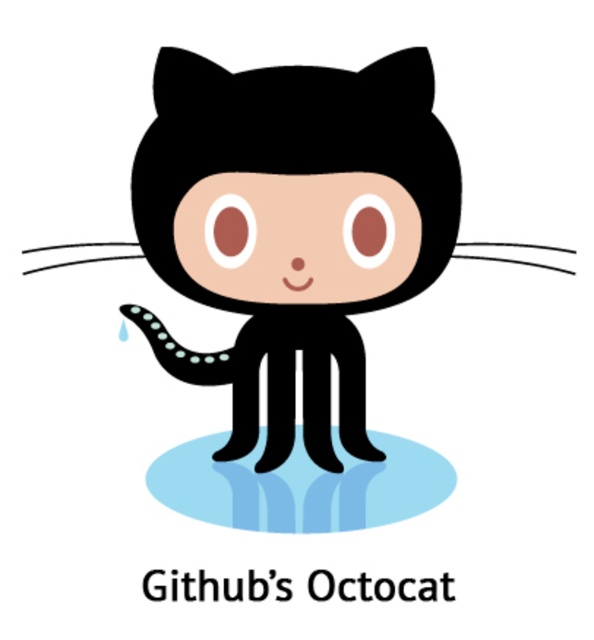
You are a visitor at an art gallery and see the Octocat artwork. The artwork has the black matte octopus at center and the blue glossy puddle at center. Which object is located to the right of the other?

The black matte octopus at center is positioned on the right side of blue glossy puddle at center.